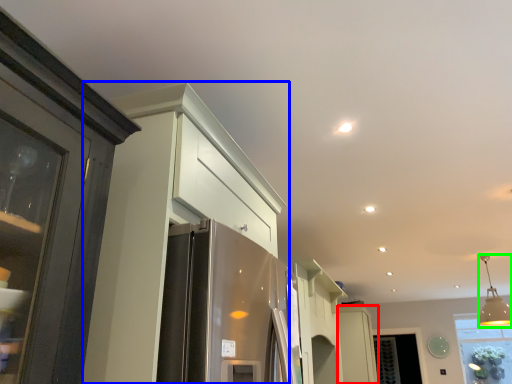
Question: Which is farther away from cabinetry (highlighted by a red box)? cabinetry (highlighted by a blue box) or light fixture (highlighted by a green box)?

Choices:
 (A) cabinetry
 (B) light fixture

Answer: (A)